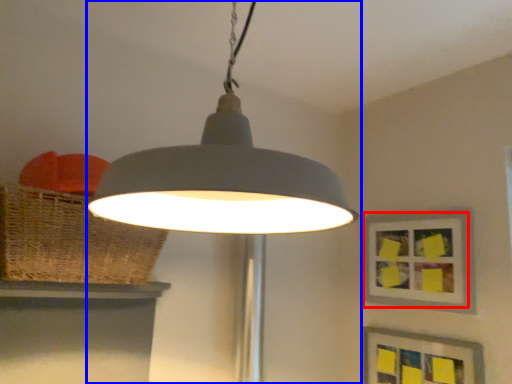
Question: Which object appears farthest to the camera in this image, picture frame (highlighted by a red box) or lamp (highlighted by a blue box)?

Choices:
 (A) picture frame
 (B) lamp

Answer: (A)